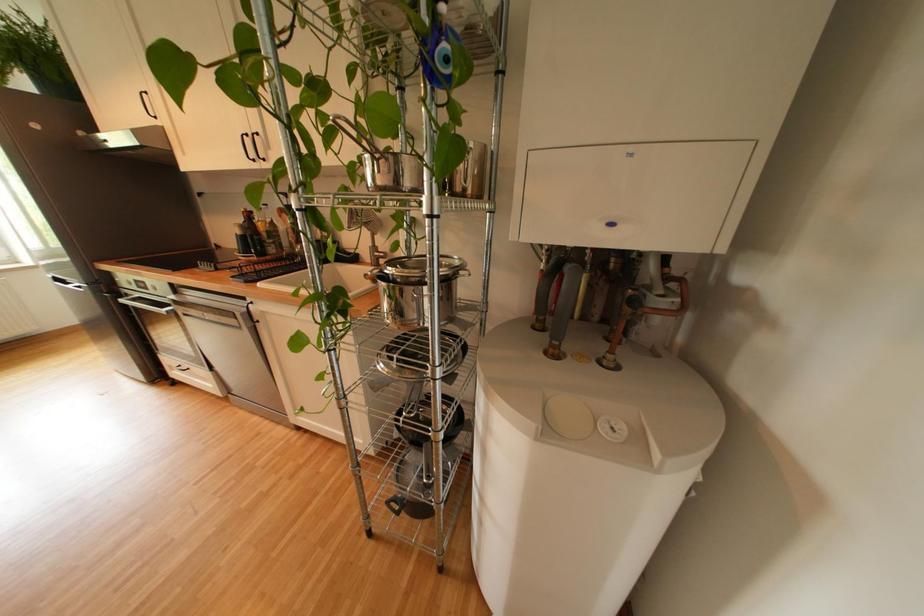
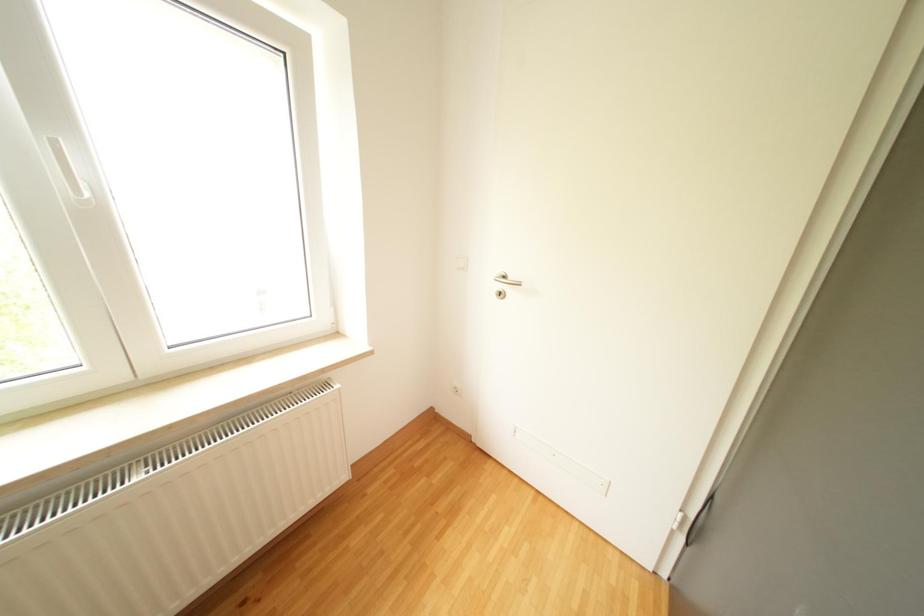
What movement of the cameraman would produce the second image?

The movement direction of the cameraman is left, forward.